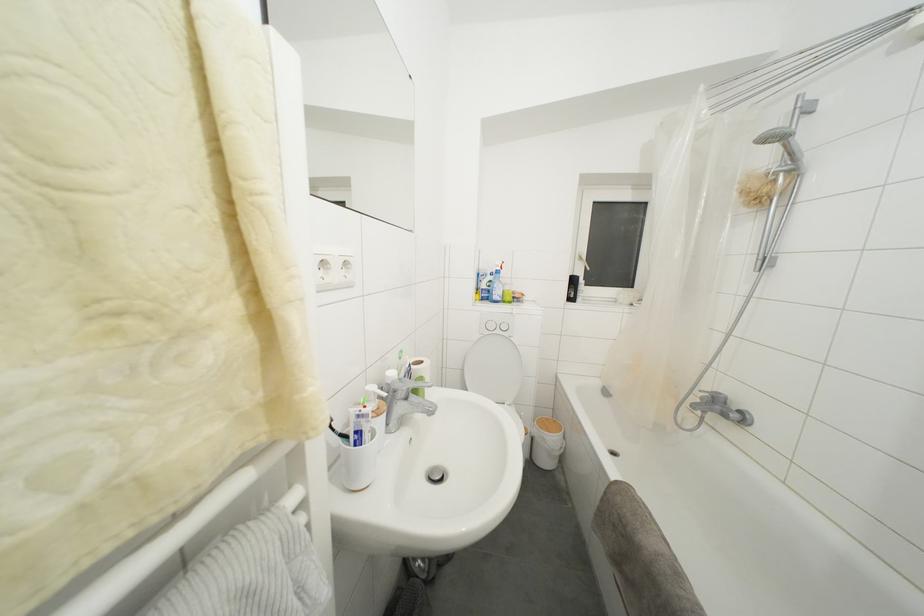
Where is `silver shower head`? The height and width of the screenshot is (616, 924). silver shower head is located at coordinates (784, 145).